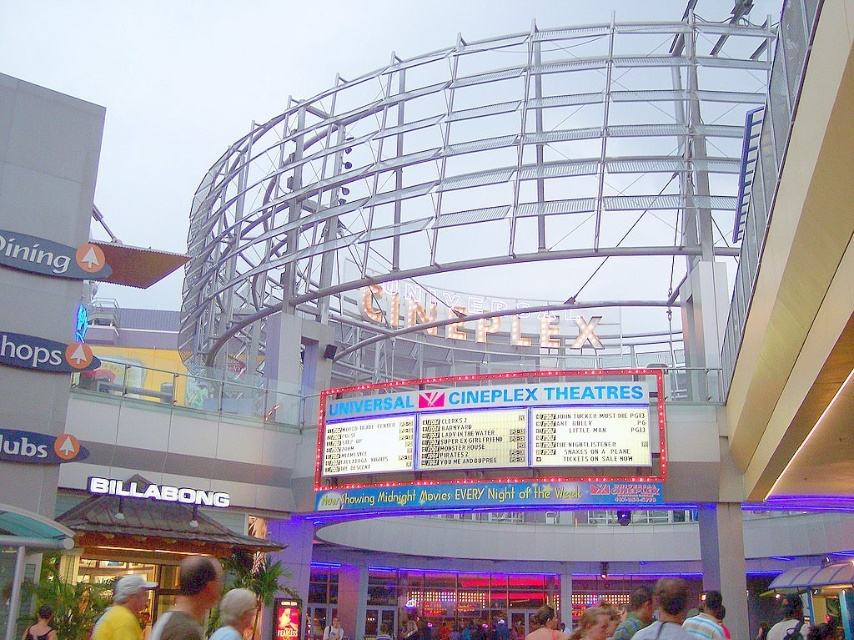
Can you confirm if red plastic marquee at center is taller than dark brown hair at lower left?

Indeed, red plastic marquee at center has a greater height compared to dark brown hair at lower left.

Who is more distant from viewer, [580,394] or [26,632]?

The point [580,394] is more distant.

Does point (585, 371) come closer to viewer compared to point (41, 608)?

That is False.

Identify the location of red plastic marquee at center. (493, 442).

Is yellow fabric at lower left taller than white hair at center?

In fact, yellow fabric at lower left may be shorter than white hair at center.

Is yellow fabric at lower left positioned at the back of white hair at center?

Yes, yellow fabric at lower left is behind white hair at center.

I want to click on yellow fabric at lower left, so click(123, 609).

Based on the photo, who is taller, red plastic marquee at center or yellow fabric at lower left?

Standing taller between the two is red plastic marquee at center.

Who is shorter, red plastic marquee at center or yellow fabric at lower left?

Standing shorter between the two is yellow fabric at lower left.

Is point (616, 412) positioned after point (97, 625)?

That is True.

At what (x,y) coordinates should I click in order to perform the action: click on red plastic marquee at center. Please return your answer as a coordinate pair (x, y). The height and width of the screenshot is (640, 854). Looking at the image, I should click on (493, 442).